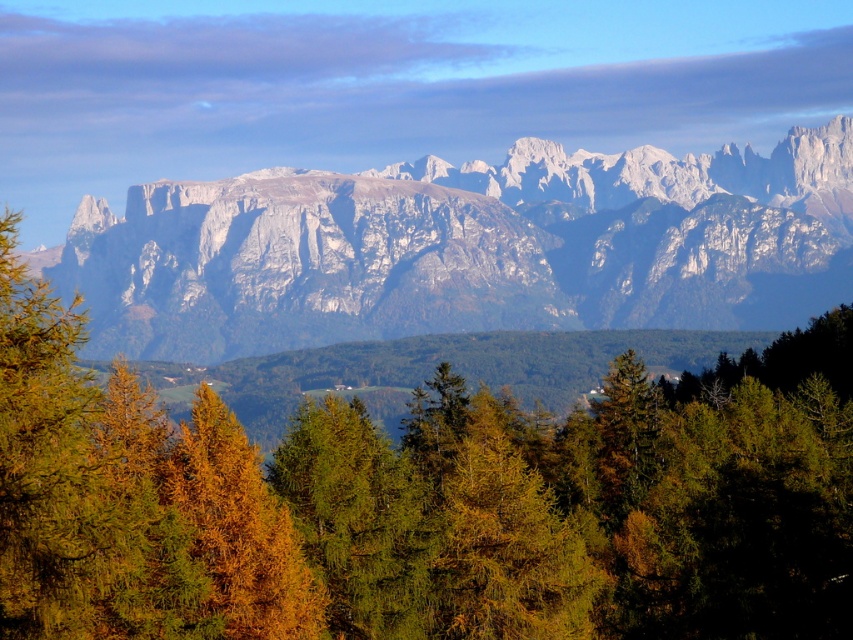
Looking at this image, you are a hiker standing at the base of the green matte tree at center. You want to take a photo of the white rocky mountain range at upper center. Can you see the entire mountain range clearly without any obstruction?

The green matte tree at center is in front of the white rocky mountain range at upper center, so the tree may partially block your view of the mountain range, making it difficult to see the entire mountain range clearly without obstruction.

You are standing at the origin point of the image. Which direction should you move to reach the green matte tree at center?

The green matte tree at center is located at coordinates point (424, 502), so you should move towards the center of the image to reach it.